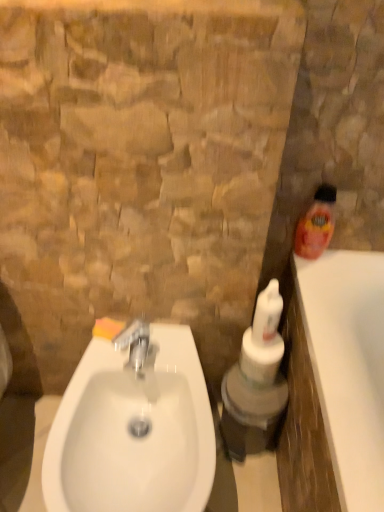
Question: Is silver metallic faucet at center oriented away from white glossy bottle at center, which is the 2th cleaning product in top-to-bottom order?

Choices:
 (A) yes
 (B) no

Answer: (B)

Question: From the image's perspective, is silver metallic faucet at center on top of white glossy bottle at center, marked as the 1th cleaning product in a left-to-right arrangement?

Choices:
 (A) no
 (B) yes

Answer: (A)

Question: Is the position of silver metallic faucet at center more distant than that of white glossy bottle at center, the first cleaning product when ordered from bottom to top?

Choices:
 (A) no
 (B) yes

Answer: (A)

Question: Does silver metallic faucet at center have a greater height compared to white glossy bottle at center, marked as the 2th cleaning product in a right-to-left arrangement?

Choices:
 (A) no
 (B) yes

Answer: (A)

Question: From a real-world perspective, is silver metallic faucet at center positioned over white glossy bottle at center, which is the 2th cleaning product in top-to-bottom order, based on gravity?

Choices:
 (A) yes
 (B) no

Answer: (B)

Question: Looking at the image, does orange plastic bottle at right, the second cleaning product in the left-to-right sequence, seem bigger or smaller compared to orange sponge at sink left?

Choices:
 (A) small
 (B) big

Answer: (B)

Question: From a real-world perspective, relative to orange sponge at sink left, is orange plastic bottle at right, the second cleaning product in the left-to-right sequence, vertically above or below?

Choices:
 (A) below
 (B) above

Answer: (B)

Question: Is orange plastic bottle at right, the second cleaning product in the left-to-right sequence, spatially inside orange sponge at sink left, or outside of it?

Choices:
 (A) outside
 (B) inside

Answer: (A)

Question: Is point (299, 256) positioned closer to the camera than point (107, 325)?

Choices:
 (A) closer
 (B) farther

Answer: (B)

Question: Does point (100, 324) appear closer or farther from the camera than point (99, 480)?

Choices:
 (A) closer
 (B) farther

Answer: (B)

Question: Is orange sponge at sink left bigger or smaller than white glossy sink at lower left?

Choices:
 (A) big
 (B) small

Answer: (B)

Question: Looking at their shapes, would you say orange sponge at sink left is wider or thinner than white glossy sink at lower left?

Choices:
 (A) wide
 (B) thin

Answer: (B)

Question: Would you say orange sponge at sink left is inside or outside white glossy sink at lower left?

Choices:
 (A) inside
 (B) outside

Answer: (B)

Question: Is white glossy bottle at center, the first cleaning product when ordered from bottom to top, taller or shorter than white glossy sink at lower left?

Choices:
 (A) short
 (B) tall

Answer: (A)

Question: From a real-world perspective, is white glossy bottle at center, which is the 2th cleaning product in top-to-bottom order, positioned above or below white glossy sink at lower left?

Choices:
 (A) above
 (B) below

Answer: (A)